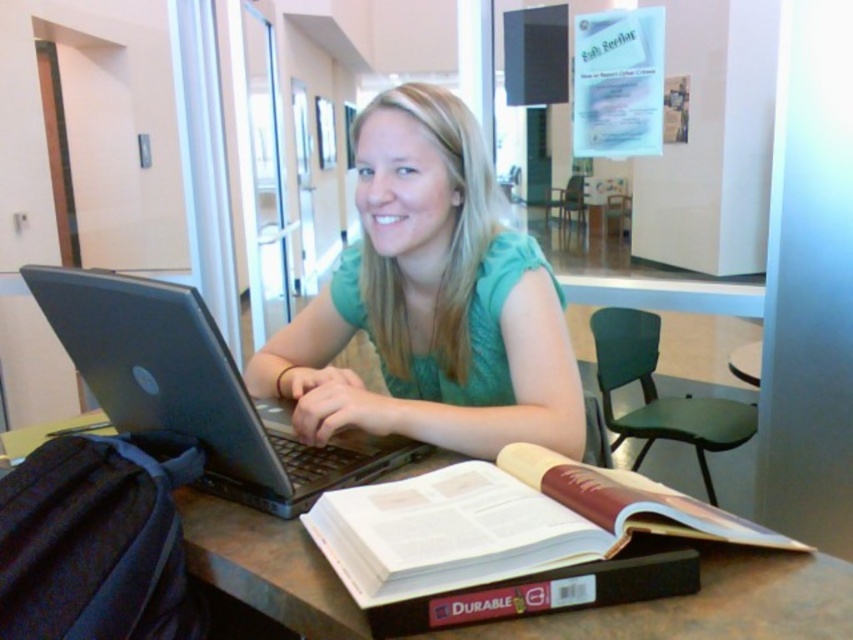
Question: Is the position of matte black laptop at center less distant than that of black matte laptop at center?

Choices:
 (A) no
 (B) yes

Answer: (A)

Question: Which object is farther from the camera taking this photo?

Choices:
 (A) hardcover book at center
 (B) matte black laptop at center
 (C) brown wooden table at center

Answer: (B)

Question: Is hardcover book at center thinner than brown wooden table at center?

Choices:
 (A) yes
 (B) no

Answer: (A)

Question: Estimate the real-world distances between objects in this image. Which object is closer to the hardcover book at center?

Choices:
 (A) matte black laptop at center
 (B) black matte laptop at center

Answer: (B)

Question: Which point is farther to the camera?

Choices:
 (A) (163, 403)
 (B) (372, 298)
 (C) (374, 540)

Answer: (B)

Question: Does matte black laptop at center have a lesser width compared to hardcover book at center?

Choices:
 (A) no
 (B) yes

Answer: (B)